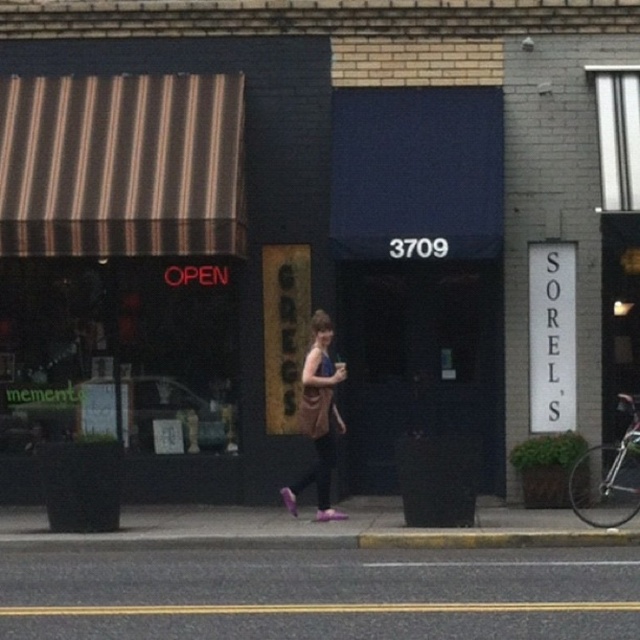
You are a delivery driver approaching the storefront and need to park your vehicle. The curb is yellow concrete curb at lower center and the road is black asphalt road at lower center. Can you determine which one is wider?

The black asphalt road at lower center is wider than the yellow concrete curb at lower center according to the description.

You are standing in front of the store and notice two points marked on the image. Which point, point (614,563) or point (323,323), is closer to you?

Point (614,563) is closer to the viewer than point (323,323).